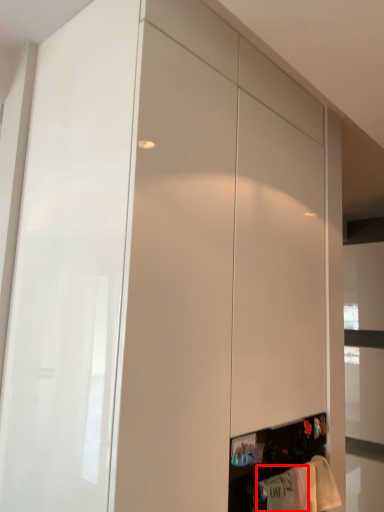
Question: Where is clothing (annotated by the red box) located in relation to clothing in the image?

Choices:
 (A) left
 (B) right

Answer: (A)